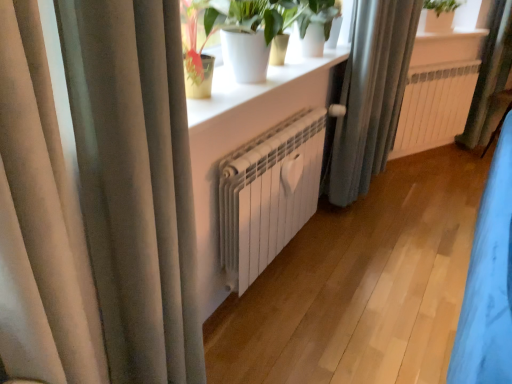
Question: In terms of size, does gray fabric curtain at center, which ranks as the second curtain in front-to-back order, appear bigger or smaller than white matte radiator at center, marked as the 2th radiator in a front-to-back arrangement?

Choices:
 (A) big
 (B) small

Answer: (A)

Question: From a real-world perspective, relative to white matte radiator at center, which is counted as the 2th radiator, starting from the bottom, is gray fabric curtain at center, which is counted as the second curtain, starting from the right, vertically above or below?

Choices:
 (A) below
 (B) above

Answer: (B)

Question: Which of these objects is positioned closest to the white matte radiator at center, which is counted as the 2th radiator, starting from the bottom?

Choices:
 (A) white matte pot at upper center
 (B) white matte radiator at center, which is the 1th radiator from bottom to top
 (C) green fabric curtain at right, the third curtain viewed from the left
 (D) gray fabric curtain at center, which is the second curtain in back-to-front order
 (E) satin beige curtain at left, the first curtain from the front

Answer: (C)

Question: Based on their relative distances, which object is farther from the white matte radiator at center, the second radiator positioned from the back?

Choices:
 (A) green fabric curtain at right, the third curtain viewed from the left
 (B) white matte radiator at center, positioned as the 1th radiator in top-to-bottom order
 (C) white matte pot at upper center
 (D) satin beige curtain at left, the third curtain when ordered from back to front
 (E) gray fabric curtain at center, which is counted as the second curtain, starting from the right

Answer: (A)